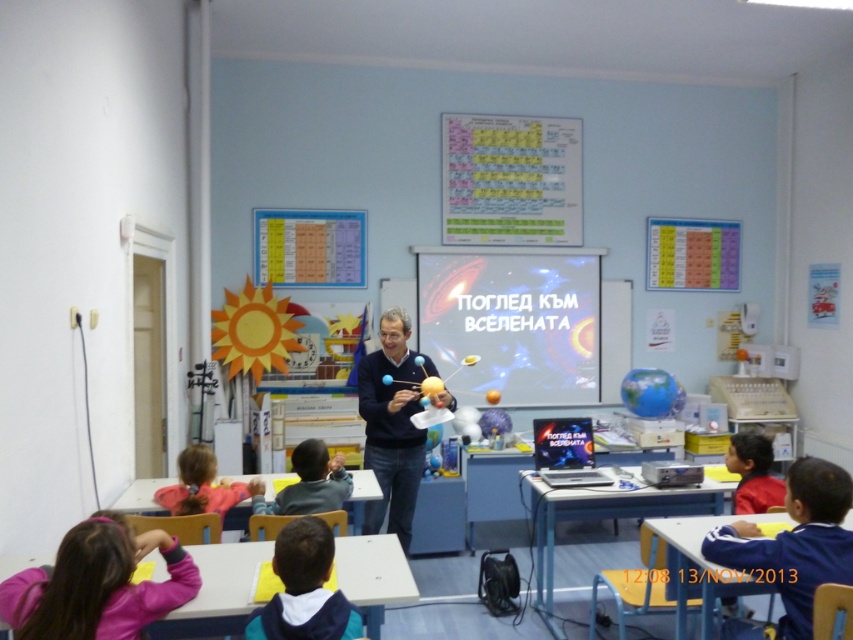
The teacher is holding a model of the solar system. Where should they place it so that it aligns with the projector screen displayed text? Use the coordinates provided to determine the correct position. The coordinates are given as a point between 0 and 1 in both x and y dimensions, with the origin at the bottom left corner of the image. The x increases to the right, and y increases upward. The point is at (514, 320).

The point at (514, 320) marks the metallic silver projector screen at center. Therefore, the teacher should place the model of the solar system in front of or near the metallic silver projector screen at center to align with the displayed text.